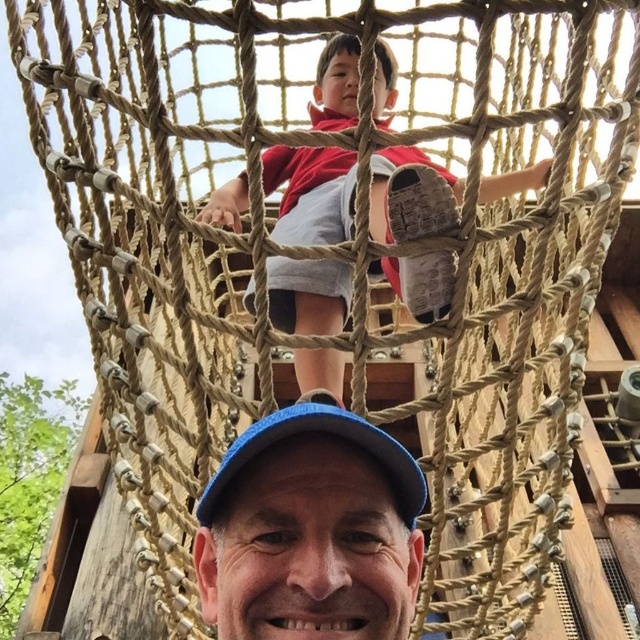
Is point (326, 240) farther from camera compared to point (339, 422)?

Yes.

Between point (301, 202) and point (406, 520), which one is positioned in front?

Point (406, 520) is more forward.

Where is `matte red shirt at upper center`? matte red shirt at upper center is located at coordinates (310, 193).